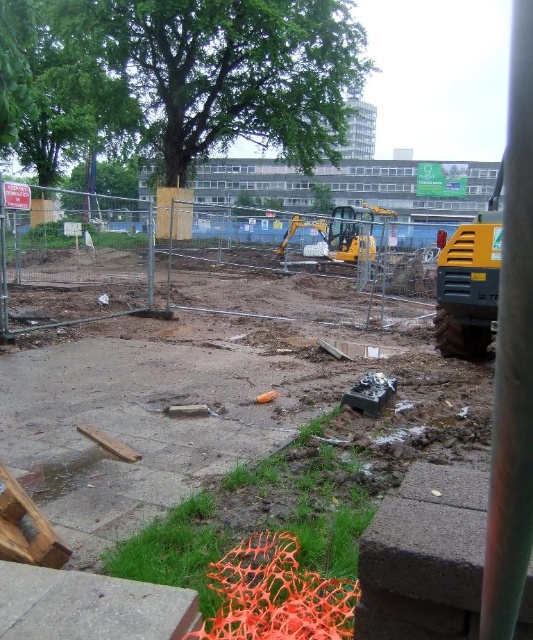
You are a delivery truck driver who needs to park your truck in the construction site. The yellow rubber excavator at right and the green leafy tree at upper center are in the way. Which object takes up more space and might block your path more?

The green leafy tree at upper center takes up more space than the yellow rubber excavator at right, so it might block your path more.

You are a delivery driver who needs to park your truck near the construction site. The truck requires a clear space that is wider than the distance between the yellow rubber excavator at right and the green leafy tree at upper center. Is there enough space available for the truck to park?

The yellow rubber excavator at right is positioned on the right side of the green leafy tree at upper center. Since the truck requires a space wider than the distance between them, but the exact distance isn